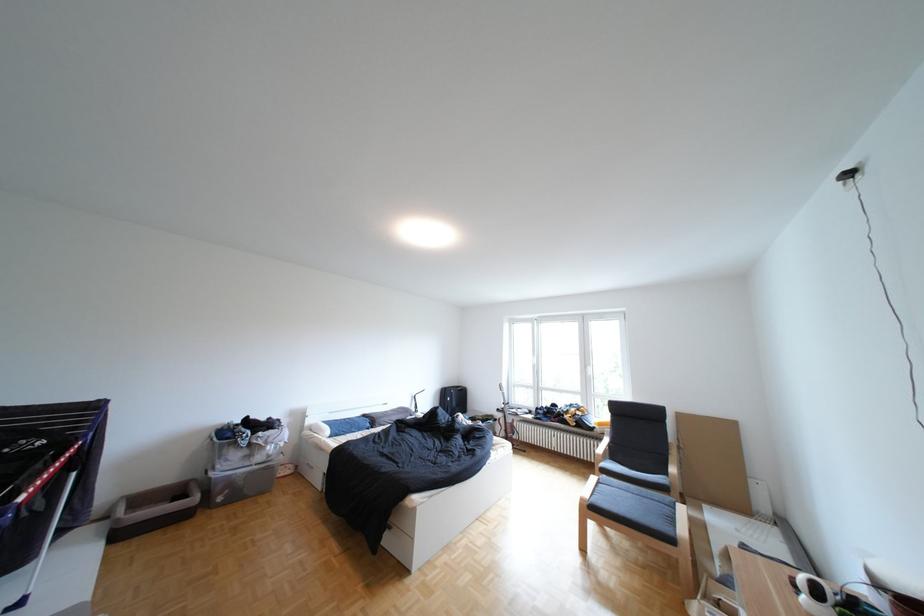
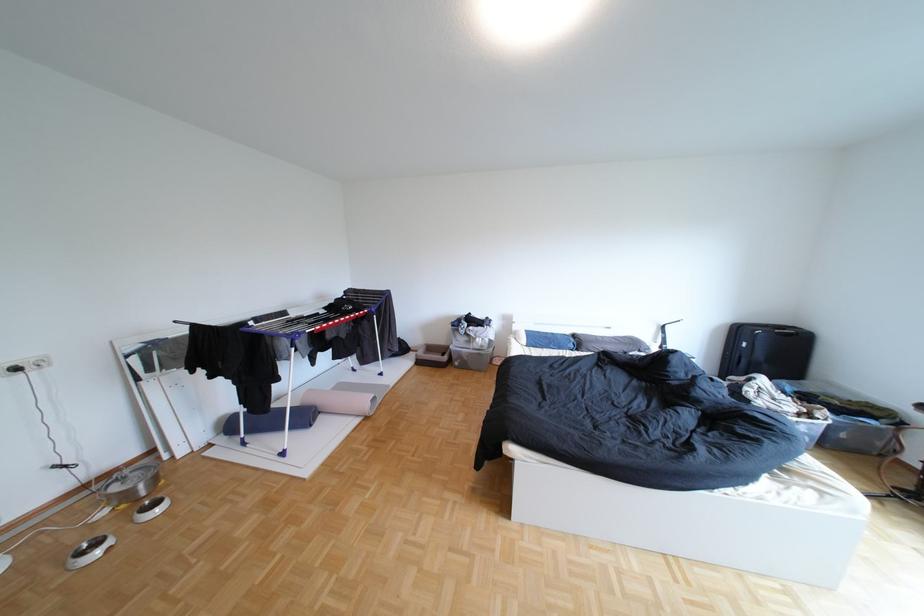
Find the pixel in the second image that matches point 236,499 in the first image.

(472, 363)